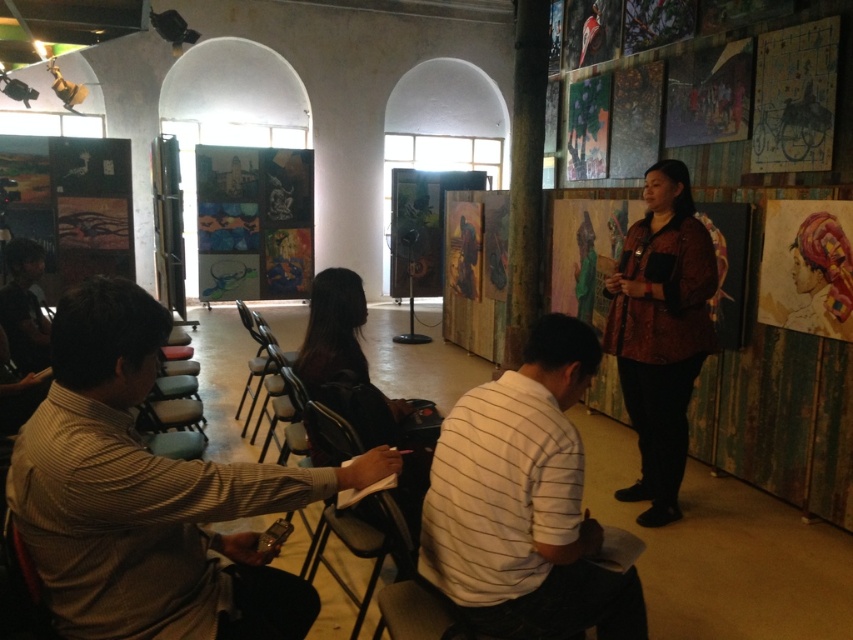
You are attending an event in the described setting and notice two attendees wearing distinct clothing items. The first is a light brown striped shirt at lower left, and the second is a printed silk blouse at center. From your perspective as someone standing at the back of the room, which clothing item is positioned lower in the image?

The light brown striped shirt at lower left is positioned lower in the image compared to the printed silk blouse at center.

You are standing at the back of the art gallery and want to take a photo of two specific points in the scene. The first point is at coordinates point (86, 596) and the second is point (488, 566). Since you want both points to be in focus, which point should you focus on to ensure the other is also sharp?

You should focus on point (488, 566) because it is farther from the camera than point (86, 596). By focusing on the farther point, the closer point will also be within the depth of field, ensuring both are in focus.

You are a photographer trying to capture a clear shot of both the light brown striped shirt at lower left and the white striped shirt at center. Since you can only focus on one person at a time, which shirt should you focus on to ensure the other is still in the background?

The light brown striped shirt at lower left is positioned over the white striped shirt at center, so focusing on the light brown striped shirt at lower left will keep the white striped shirt at center in the background.